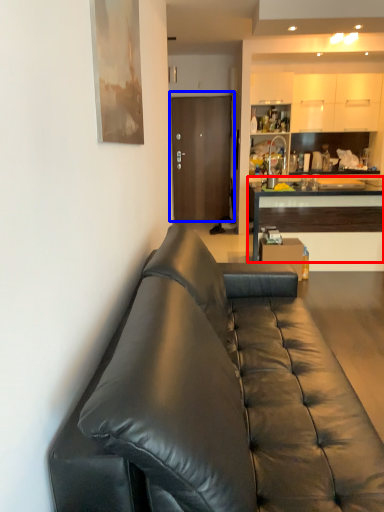
Question: Which point is closer to the camera, cabinetry (highlighted by a red box) or door (highlighted by a blue box)?

Choices:
 (A) cabinetry
 (B) door

Answer: (A)